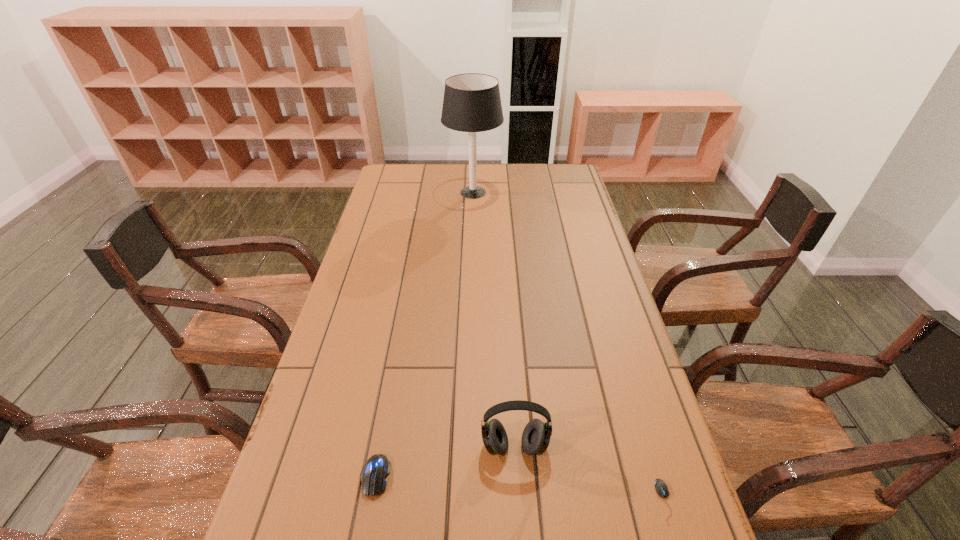
The height and width of the screenshot is (540, 960). Find the location of `object located in the far edge section of the desktop`. object located in the far edge section of the desktop is located at coordinates tap(472, 103).

This screenshot has width=960, height=540. Find the location of `object present at the left edge`. object present at the left edge is located at coordinates click(374, 472).

Locate an element on the screen. object that is at the right edge is located at coordinates (661, 488).

Where is `vacant position at the far edge of the desktop`? vacant position at the far edge of the desktop is located at coordinates (426, 190).

Where is `vacant space at the left edge of the desktop`? vacant space at the left edge of the desktop is located at coordinates (319, 384).

Identify the location of vacant space at the right edge of the desktop. This screenshot has height=540, width=960. (589, 321).

Find the location of `vacant area at the far left corner of the desktop`. vacant area at the far left corner of the desktop is located at coordinates coord(400,183).

Identify the location of vacant space at the far right corner of the desktop. This screenshot has height=540, width=960. (551, 168).

In order to click on free space between the shortest object and the left mouse in this screenshot , I will do `click(520, 488)`.

The image size is (960, 540). I want to click on free space between the left mouse and the tallest object, so click(424, 334).